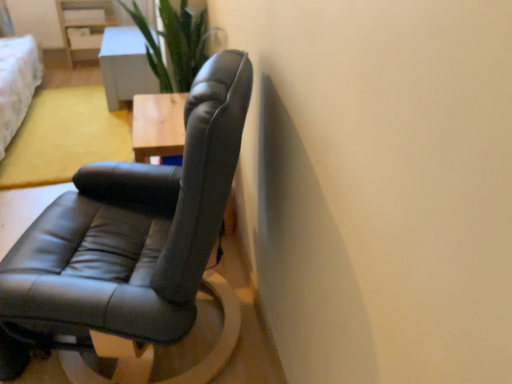
Question: From a real-world perspective, relative to black leather chair at center, is light gray wooden table at upper center vertically above or below?

Choices:
 (A) above
 (B) below

Answer: (B)

Question: From the image's perspective, is light gray wooden table at upper center located above or below black leather chair at center?

Choices:
 (A) below
 (B) above

Answer: (B)

Question: Is light gray wooden table at upper center in front of or behind black leather chair at center in the image?

Choices:
 (A) front
 (B) behind

Answer: (B)

Question: Is black leather chair at center bigger or smaller than light gray wooden table at upper center?

Choices:
 (A) small
 (B) big

Answer: (B)

Question: Considering their positions, is black leather chair at center located in front of or behind light gray wooden table at upper center?

Choices:
 (A) front
 (B) behind

Answer: (A)

Question: From the image's perspective, is black leather chair at center positioned above or below light gray wooden table at upper center?

Choices:
 (A) above
 (B) below

Answer: (B)

Question: Choose the correct answer: Is black leather chair at center inside light gray wooden table at upper center or outside it?

Choices:
 (A) inside
 (B) outside

Answer: (B)